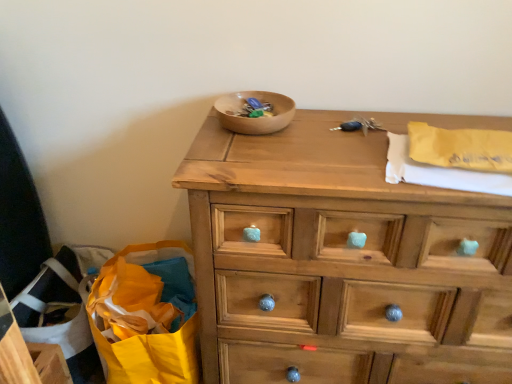
Locate an element on the screen. This screenshot has height=384, width=512. vacant space in between wooden bowl at center and yellow paper at upper right is located at coordinates (330, 142).